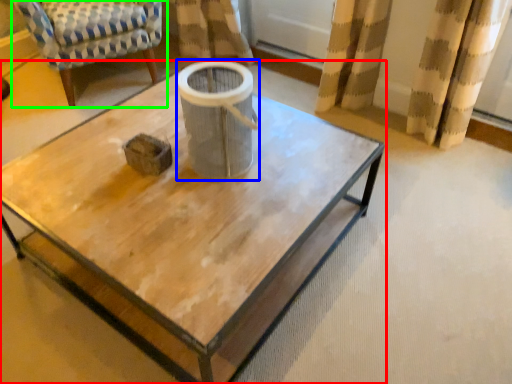
Question: Which object is positioned closest to coffee table (highlighted by a red box)? Select from gray (highlighted by a blue box) and chair (highlighted by a green box).

Choices:
 (A) gray
 (B) chair

Answer: (A)